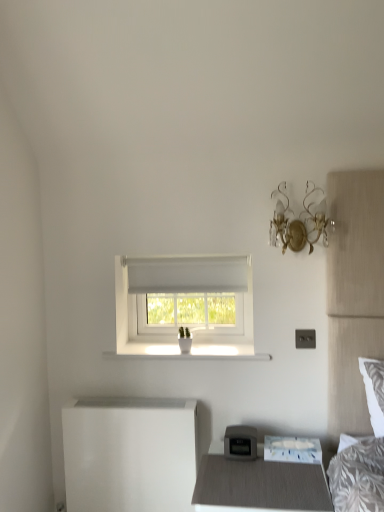
Locate an element on the screen. This screenshot has height=512, width=384. vacant area that is in front of white paper at lower right is located at coordinates (288, 475).